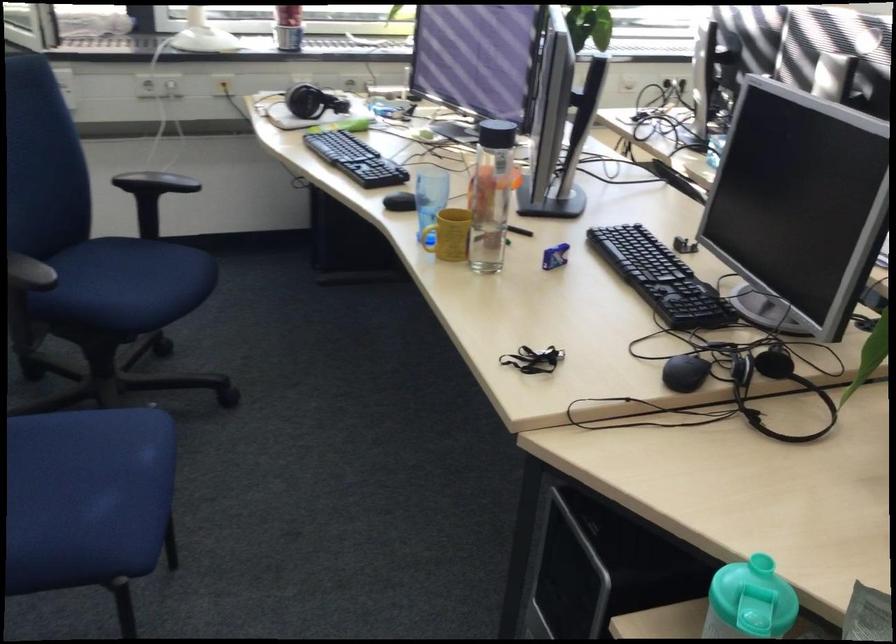
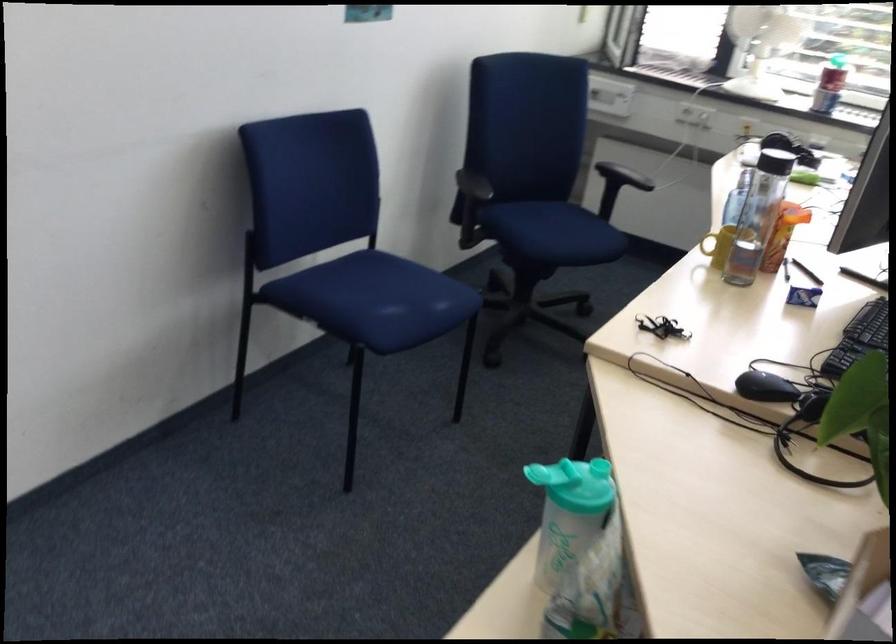
Locate, in the second image, the point that corresponds to point (82, 505) in the first image.

(374, 299)